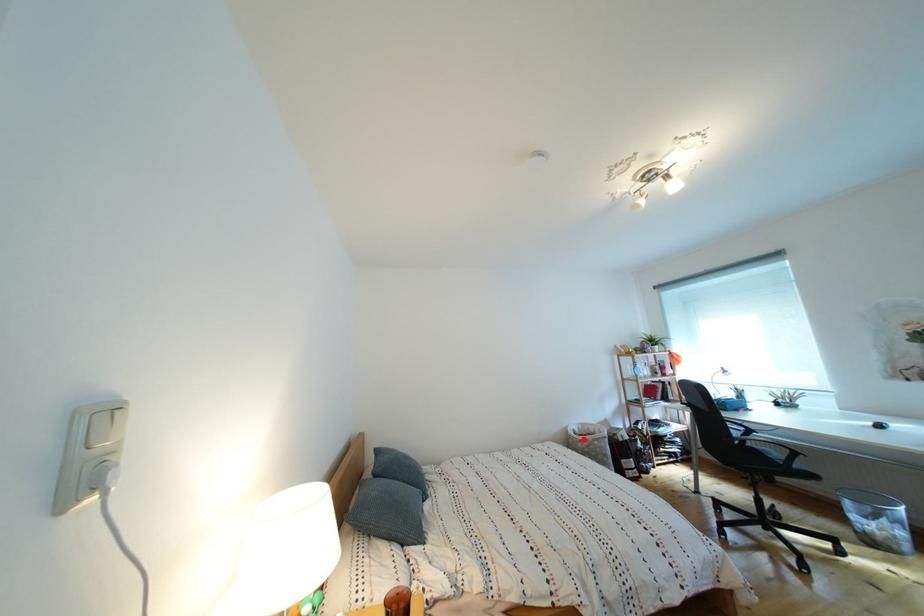
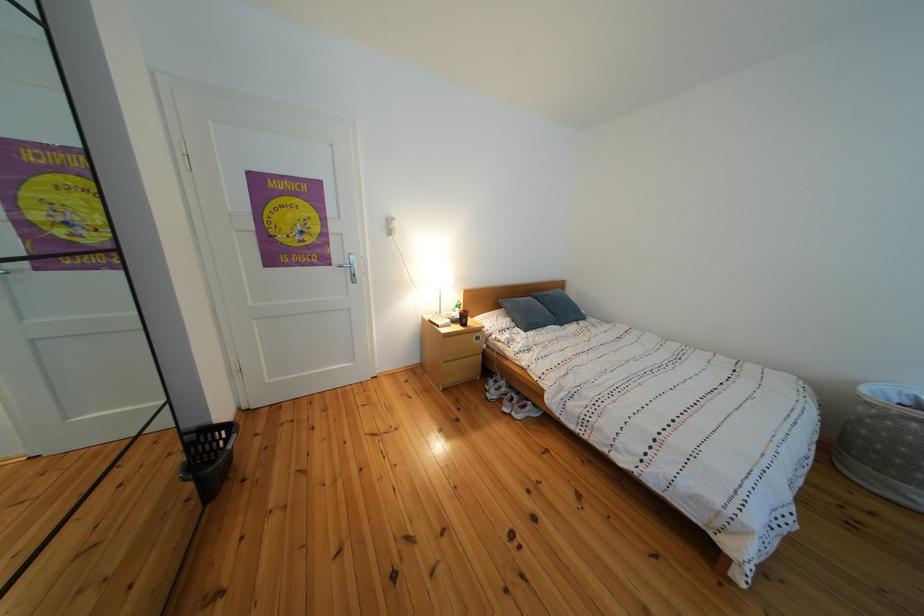
Where in the second image is the point corresponding to the highlighted location from the first image?

(890, 398)